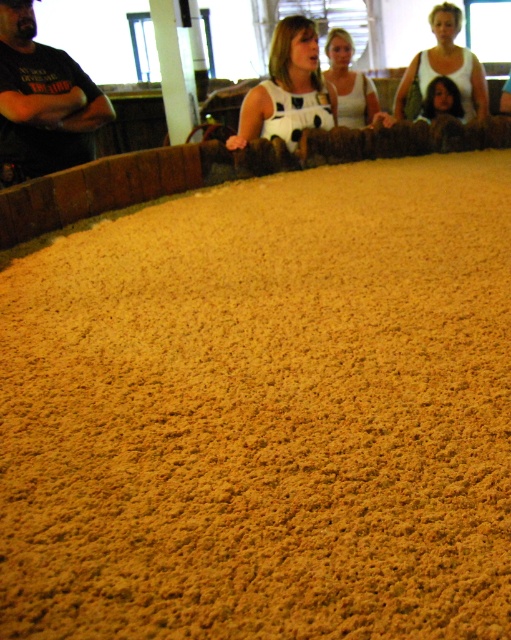
You are a photographer trying to capture a clear shot of both the white dotted dress at center and the white matte tank top at upper center. Since you want to ensure both are visible, which clothing item should you focus on first to avoid blurring due to size differences?

The white dotted dress at center is bigger than the white matte tank top at upper center, so you should focus on the white dotted dress at center first to ensure it is in sharp focus before adjusting for the smaller one.

Consider the image. You are standing 5 meters away from the fermentation bed and want to take a closer look. Is the point at coordinates point (434, 26) on the fermentation bed surface within your current viewing range?

The distance of point (434, 26) from the camera is 4.79 meters, so yes, the point is within your current viewing range since you are standing 5 meters away.

You are standing at the origin point of the image. Where is the white dotted dress at upper center located?

The white dotted dress at upper center is located at point 0.105 on the x axis and 0.873 on the y axis.